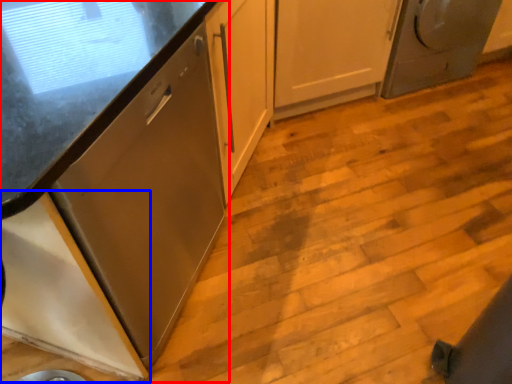
Question: Which object is closer to the camera taking this photo, cabinetry (highlighted by a red box) or cabinetry (highlighted by a blue box)?

Choices:
 (A) cabinetry
 (B) cabinetry

Answer: (B)